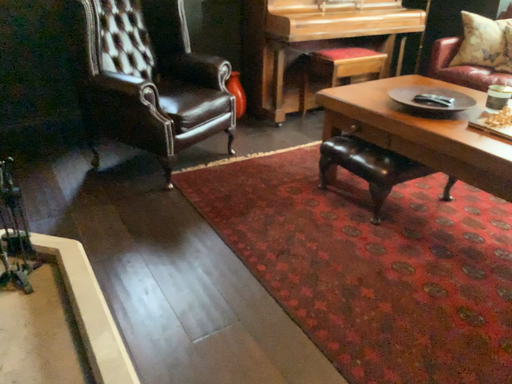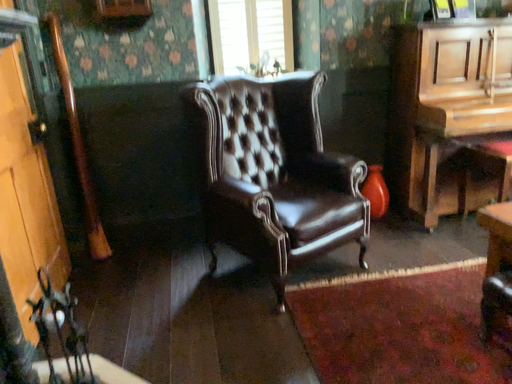
Question: Which way did the camera rotate in the video?

Choices:
 (A) rotated right
 (B) rotated left

Answer: (B)